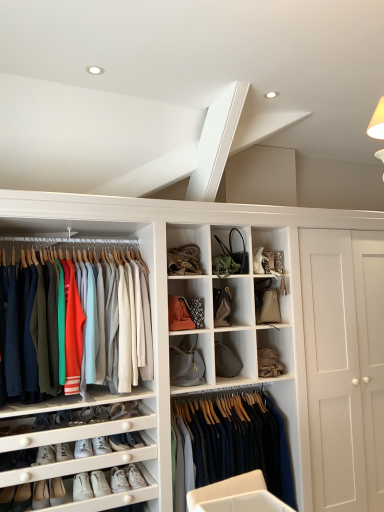
Question: Does dark blue wool sweater at center, positioned as the second clothing in left-to-right order, lie in front of matte black handbag at upper center, which appears as the 2th accessory when ordered from the bottom?

Choices:
 (A) yes
 (B) no

Answer: (A)

Question: Does dark blue wool sweater at center, positioned as the second clothing in left-to-right order, have a greater width compared to matte black handbag at upper center, the 1th accessory viewed from the top?

Choices:
 (A) yes
 (B) no

Answer: (A)

Question: Is the depth of dark blue wool sweater at center, the 1th clothing when ordered from bottom to top, greater than that of matte black handbag at upper center, which is the 2th accessory from left to right?

Choices:
 (A) yes
 (B) no

Answer: (B)

Question: Can you confirm if dark blue wool sweater at center, which is the 2th clothing in top-to-bottom order, is bigger than matte black handbag at upper center, the 1th accessory viewed from the top?

Choices:
 (A) no
 (B) yes

Answer: (B)

Question: Would you say dark blue wool sweater at center, which is the 2th clothing in top-to-bottom order, is outside matte black handbag at upper center, which ranks as the first accessory in right-to-left order?

Choices:
 (A) no
 (B) yes

Answer: (B)

Question: From the image's perspective, is dark blue wool sweater at center, placed as the 1th clothing when sorted from right to left, beneath matte black handbag at upper center, the 1th accessory viewed from the top?

Choices:
 (A) yes
 (B) no

Answer: (A)

Question: Is matte gray fabric handbag at center, arranged as the 2th cabinet when ordered from the bottom, turned away from matte brown leather handbag at center, the 4th cabinet positioned from the bottom?

Choices:
 (A) yes
 (B) no

Answer: (B)

Question: From the image's perspective, is matte gray fabric handbag at center, which is the third cabinet from top to bottom, below matte brown leather handbag at center, the 4th cabinet positioned from the bottom?

Choices:
 (A) no
 (B) yes

Answer: (B)

Question: Is matte gray fabric handbag at center, which is the third cabinet from top to bottom, beside matte brown leather handbag at center, the 4th cabinet positioned from the bottom?

Choices:
 (A) no
 (B) yes

Answer: (A)

Question: Considering the relative positions of matte gray fabric handbag at center, arranged as the 2th cabinet when ordered from the bottom, and matte brown leather handbag at center, arranged as the 1th cabinet when viewed from the top, in the image provided, is matte gray fabric handbag at center, arranged as the 2th cabinet when ordered from the bottom, behind matte brown leather handbag at center, arranged as the 1th cabinet when viewed from the top,?

Choices:
 (A) yes
 (B) no

Answer: (A)

Question: Considering the relative sizes of matte gray fabric handbag at center, arranged as the 2th cabinet when ordered from the bottom, and matte brown leather handbag at center, arranged as the 1th cabinet when viewed from the top, in the image provided, is matte gray fabric handbag at center, arranged as the 2th cabinet when ordered from the bottom, taller than matte brown leather handbag at center, arranged as the 1th cabinet when viewed from the top,?

Choices:
 (A) yes
 (B) no

Answer: (A)

Question: Considering the relative positions of matte gray fabric handbag at center, which is the third cabinet from top to bottom, and matte brown leather handbag at center, arranged as the 1th cabinet when viewed from the top, in the image provided, is matte gray fabric handbag at center, which is the third cabinet from top to bottom, to the left of matte brown leather handbag at center, arranged as the 1th cabinet when viewed from the top, from the viewer's perspective?

Choices:
 (A) no
 (B) yes

Answer: (A)

Question: From the image's perspective, is matte gray fabric handbag at center, arranged as the 2th cabinet when ordered from the bottom, on top of white leather sneakers at lower left, which is the 4th footwear in right-to-left order?

Choices:
 (A) no
 (B) yes

Answer: (B)